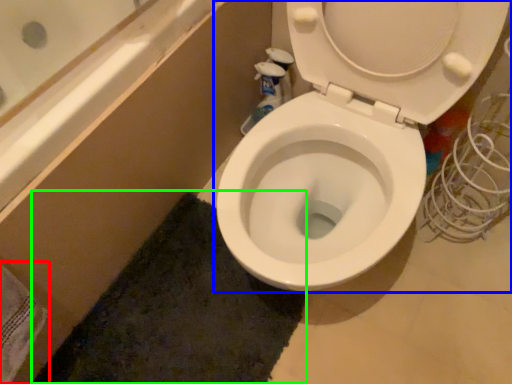
Question: Estimate the real-world distances between objects in this image. Which object is farther from bath towel (highlighted by a red box), toilet (highlighted by a blue box) or bath mat (highlighted by a green box)?

Choices:
 (A) toilet
 (B) bath mat

Answer: (A)